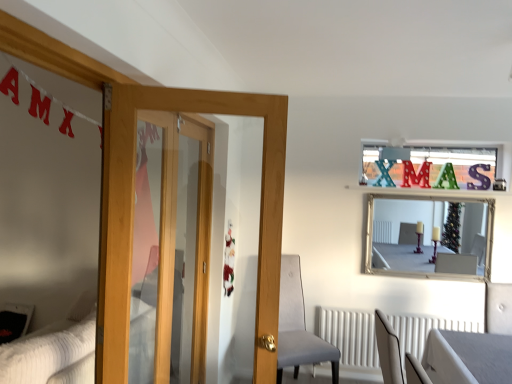
This screenshot has width=512, height=384. What do you see at coordinates (479, 177) in the screenshot? I see `metallic silver letter at upper right, which appears as the 1th letter when viewed from the right` at bounding box center [479, 177].

The image size is (512, 384). I want to click on matte red letter m at upper center, which is the first letter from left to right, so click(416, 174).

Where is `velvet grey chair at center`? velvet grey chair at center is located at coordinates (298, 326).

You are a GUI agent. You are given a task and a screenshot of the screen. Output one action in this format:
    pyautogui.click(x=<x>, y=<y>)
    Task: Click on the silver/glass mirror at upper center
    Image resolution: width=512 pixels, height=384 pixels.
    Given the screenshot: What is the action you would take?
    pyautogui.click(x=428, y=237)

Can you confirm if velvet grey chair at center is smaller than white textured bed at lower left?

Correct, velvet grey chair at center occupies less space than white textured bed at lower left.

Can you confirm if velvet grey chair at center is positioned to the left of white textured bed at lower left?

In fact, velvet grey chair at center is to the right of white textured bed at lower left.

Which object is more forward, velvet grey chair at center or white textured bed at lower left?

white textured bed at lower left is in front.

Are velvet grey chair at center and white textured bed at lower left making contact?

No, velvet grey chair at center is not touching white textured bed at lower left.

Which is in front, point (112, 154) or point (475, 187)?

The point (112, 154) is in front.

Considering the relative sizes of wooden door at left and metallic silver letter at upper right, which appears as the 1th letter when viewed from the right, in the image provided, is wooden door at left bigger than metallic silver letter at upper right, which appears as the 1th letter when viewed from the right,?

Indeed, wooden door at left has a larger size compared to metallic silver letter at upper right, which appears as the 1th letter when viewed from the right.

Is wooden door at left at the left side of metallic silver letter at upper right, which appears as the 1th letter when viewed from the right?

Yes.

From the image's perspective, is wooden door at left on metallic silver letter at upper right, which appears as the 1th letter when viewed from the right?

No.

Is silver/glass mirror at upper center located outside white textured bed at lower left?

Yes, silver/glass mirror at upper center is outside of white textured bed at lower left.

In the scene shown: Which point is more forward, [400,274] or [52,327]?

The point [400,274] is in front.

Between silver/glass mirror at upper center and white textured bed at lower left, which one has larger width?

white textured bed at lower left is wider.

Is metallic silver letter at upper right, the 2th letter viewed from the left, far away from white textured bed at lower left?

Indeed, metallic silver letter at upper right, the 2th letter viewed from the left, is not near white textured bed at lower left.

Which point is more forward, (x=479, y=167) or (x=51, y=365)?

Point (x=51, y=365)

From a real-world perspective, is metallic silver letter at upper right, the 2th letter viewed from the left, physically located above or below white textured bed at lower left?

metallic silver letter at upper right, the 2th letter viewed from the left, is above white textured bed at lower left.

From the image's perspective, which one is positioned lower, metallic silver letter at upper right, which appears as the 1th letter when viewed from the right, or white textured bed at lower left?

white textured bed at lower left is shown below in the image.

Find the location of a particular element. This screenshot has width=512, height=384. letter on the left of the silver/glass mirror at upper center is located at coordinates (416, 174).

Which object is closer to the camera taking this photo, matte red letter m at upper center, which is the first letter from left to right, or silver/glass mirror at upper center?

silver/glass mirror at upper center is in front.

Is matte red letter m at upper center, which is the first letter from left to right, far from silver/glass mirror at upper center?

No, matte red letter m at upper center, which is the first letter from left to right, is not far away from silver/glass mirror at upper center.

Does matte red letter m at upper center, the second letter viewed from the right, have a lesser width compared to silver/glass mirror at upper center?

Yes, matte red letter m at upper center, the second letter viewed from the right, is thinner than silver/glass mirror at upper center.

Between white textured radiator at lower center and matte red letter m at upper center, the second letter viewed from the right, which one is positioned in front?

white textured radiator at lower center is more forward.

Can you confirm if white textured radiator at lower center is thinner than matte red letter m at upper center, the second letter viewed from the right?

Incorrect, the width of white textured radiator at lower center is not less than that of matte red letter m at upper center, the second letter viewed from the right.

In the scene shown: Are white textured radiator at lower center and matte red letter m at upper center, the second letter viewed from the right, located far from each other?

white textured radiator at lower center is positioned a significant distance from matte red letter m at upper center, the second letter viewed from the right.

Considering the sizes of objects white textured radiator at lower center and matte red letter m at upper center, which is the first letter from left to right, in the image provided, who is bigger, white textured radiator at lower center or matte red letter m at upper center, which is the first letter from left to right,?

white textured radiator at lower center is bigger.

Which of these two, white textured bed at lower left or silver/glass mirror at upper center, is thinner?

silver/glass mirror at upper center is thinner.

Is white textured bed at lower left facing away from silver/glass mirror at upper center?

Yes, silver/glass mirror at upper center is at the back of white textured bed at lower left.

How many degrees apart are the facing directions of white textured bed at lower left and silver/glass mirror at upper center?

91.7 degrees separate the facing orientations of white textured bed at lower left and silver/glass mirror at upper center.

Considering the relative sizes of white textured bed at lower left and silver/glass mirror at upper center in the image provided, is white textured bed at lower left smaller than silver/glass mirror at upper center?

No, white textured bed at lower left is not smaller than silver/glass mirror at upper center.

Where is `bed in front of the velvet grey chair at center`? bed in front of the velvet grey chair at center is located at coordinates (55, 350).

This screenshot has height=384, width=512. I want to click on door below the metallic silver letter at upper right, the 2th letter viewed from the left (from a real-world perspective), so click(x=133, y=206).

In the scene shown: Estimate the real-world distances between objects in this image. Which object is closer to velvet grey chair at center, matte red letter m at upper center, the second letter viewed from the right, or metallic silver letter at upper right, which appears as the 1th letter when viewed from the right?

matte red letter m at upper center, the second letter viewed from the right, lies closer to velvet grey chair at center than the other object.

When comparing their distances from white textured bed at lower left, does metallic silver letter at upper right, the 2th letter viewed from the left, or white textured radiator at lower center seem closer?

Among the two, white textured radiator at lower center is located nearer to white textured bed at lower left.

Considering their positions, is silver/glass mirror at upper center positioned closer to matte red letter m at upper center, which is the first letter from left to right, than wooden door at left?

silver/glass mirror at upper center is positioned closer to the anchor matte red letter m at upper center, which is the first letter from left to right.

From the image, which object appears to be nearer to wooden door at left, white textured radiator at lower center or velvet grey chair at center?

The object closer to wooden door at left is velvet grey chair at center.

Estimate the real-world distances between objects in this image. Which object is closer to white textured radiator at lower center, wooden door at left or metallic silver letter at upper right, which appears as the 1th letter when viewed from the right?

metallic silver letter at upper right, which appears as the 1th letter when viewed from the right, is positioned closer to the anchor white textured radiator at lower center.

Looking at the image, which one is located further to matte red letter m at upper center, the second letter viewed from the right, silver/glass mirror at upper center or metallic silver letter at upper right, which appears as the 1th letter when viewed from the right?

silver/glass mirror at upper center is positioned further to the anchor matte red letter m at upper center, the second letter viewed from the right.

Estimate the real-world distances between objects in this image. Which object is closer to white textured bed at lower left, silver/glass mirror at upper center or velvet grey chair at center?

Based on the image, velvet grey chair at center appears to be nearer to white textured bed at lower left.

From the image, which object appears to be nearer to silver/glass mirror at upper center, white textured bed at lower left or matte red letter m at upper center, the second letter viewed from the right?

matte red letter m at upper center, the second letter viewed from the right.

Where is `mirror between metallic silver letter at upper right, the 2th letter viewed from the left, and white textured radiator at lower center vertically`? mirror between metallic silver letter at upper right, the 2th letter viewed from the left, and white textured radiator at lower center vertically is located at coordinates (428, 237).

You are a GUI agent. You are given a task and a screenshot of the screen. Output one action in this format:
    pyautogui.click(x=<x>, y=<y>)
    Task: Click on the radiator situated between white textured bed at lower left and silver/glass mirror at upper center from left to right
    
    Given the screenshot: What is the action you would take?
    pyautogui.click(x=350, y=336)

I want to click on radiator positioned between wooden door at left and metallic silver letter at upper right, the 2th letter viewed from the left, from near to far, so click(350, 336).

The height and width of the screenshot is (384, 512). Find the location of `mirror between wooden door at left and metallic silver letter at upper right, the 2th letter viewed from the left, in the horizontal direction`. mirror between wooden door at left and metallic silver letter at upper right, the 2th letter viewed from the left, in the horizontal direction is located at coordinates (428, 237).